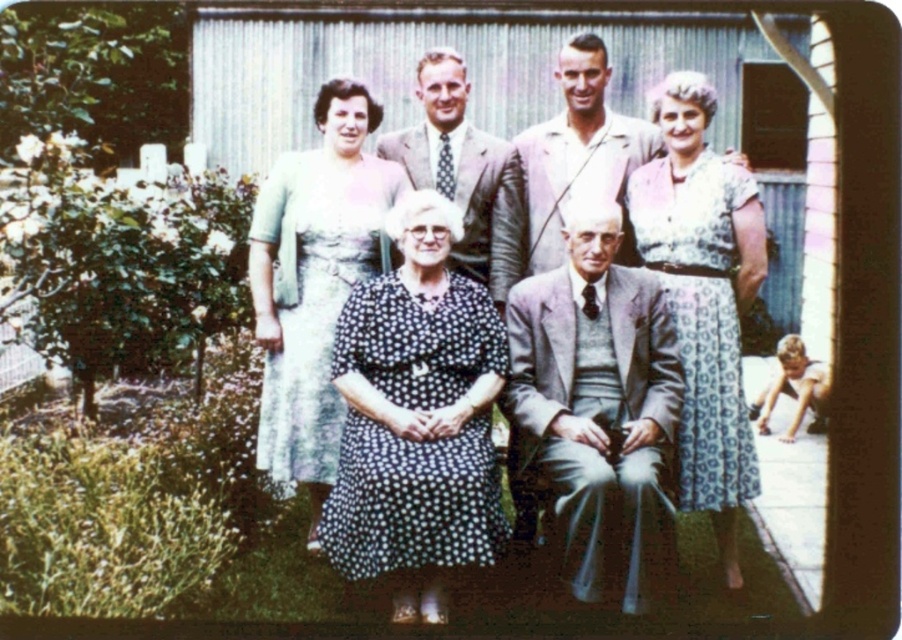
Can you confirm if polka dot dress at center is shorter than polka dot fabric dress at center?

No, polka dot dress at center is not shorter than polka dot fabric dress at center.

Does point (658, 216) come in front of point (400, 131)?

That is True.

What do you see at coordinates (665, 250) in the screenshot? This screenshot has width=902, height=640. I see `polka dot dress at center` at bounding box center [665, 250].

The height and width of the screenshot is (640, 902). What are the coordinates of `polka dot dress at center` in the screenshot? It's located at (665, 250).

Is point (743, 266) farther from viewer compared to point (360, 474)?

That is True.

Does polka dot dress at center have a greater width compared to black dotted dress at center?

Yes.

Image resolution: width=902 pixels, height=640 pixels. Find the location of `polka dot dress at center`. polka dot dress at center is located at coordinates (665, 250).

Does black dotted dress at center have a lesser height compared to printed cotton dress at center?

Yes, black dotted dress at center is shorter than printed cotton dress at center.

Which of these two, black dotted dress at center or printed cotton dress at center, stands taller?

With more height is printed cotton dress at center.

Find the location of a particular element. Image resolution: width=902 pixels, height=640 pixels. black dotted dress at center is located at coordinates (416, 419).